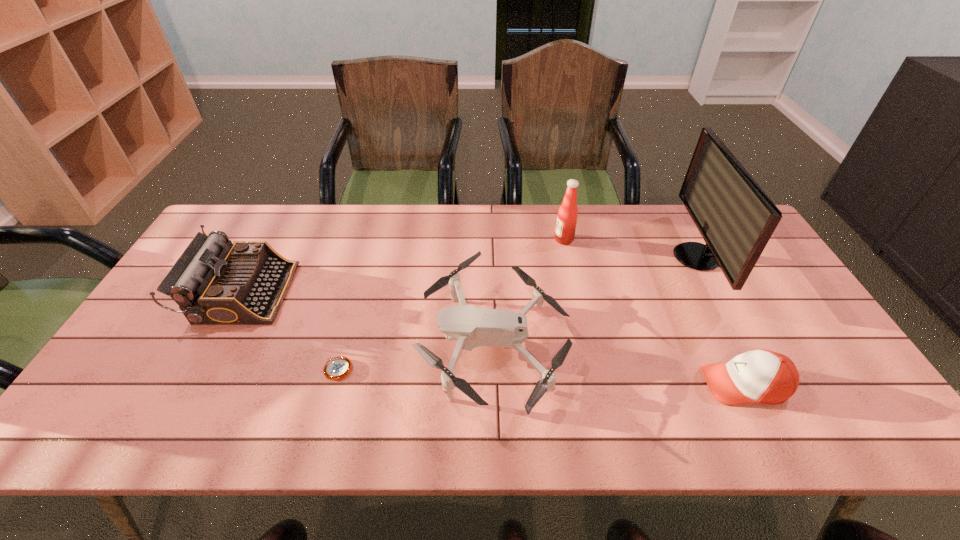
The image size is (960, 540). Identify the location of free space between the leftmost object and the computer monitor. (469, 275).

The width and height of the screenshot is (960, 540). I want to click on free point between the shortest object and the second tallest object, so click(451, 305).

Where is `free space between the third tallest object and the computer monitor`? free space between the third tallest object and the computer monitor is located at coordinates (469, 275).

At what (x,y) coordinates should I click in order to perform the action: click on vacant area that lies between the baseball cap and the computer monitor. Please return your answer as a coordinate pair (x, y). The image size is (960, 540). Looking at the image, I should click on (719, 321).

Identify the location of free spot between the fourth shortest object and the fifth shortest object. (403, 266).

Where is `blank region between the computer monitor and the third object from left to right`? This screenshot has width=960, height=540. blank region between the computer monitor and the third object from left to right is located at coordinates (595, 300).

Locate an element on the screen. The height and width of the screenshot is (540, 960). object that is the fifth closest to the baseball cap is located at coordinates (214, 282).

Locate which object ranks fifth in proximity to the third tallest object. Please provide its 2D coordinates. Your answer should be formatted as a tuple, i.e. [(x, y)], where the tuple contains the x and y coordinates of a point satisfying the conditions above.

[(735, 217)]

Identify the location of free space that satisfies the following two spatial constraints: 1. with a camera at the front of the drone; 2. on the front side of the shortest object. (494, 369).

Find the location of a particular element. This screenshot has width=960, height=540. blank space that satisfies the following two spatial constraints: 1. on the front-facing side of the condiment; 2. on the front side of the compass is located at coordinates (591, 369).